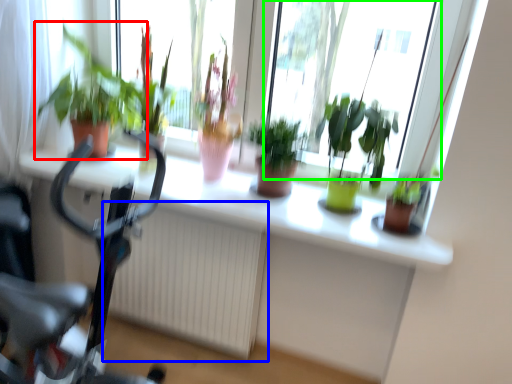
Question: Which object is positioned farthest from houseplant (highlighted by a red box)? Select from radiator (highlighted by a blue box) and bay window (highlighted by a green box).

Choices:
 (A) radiator
 (B) bay window

Answer: (B)